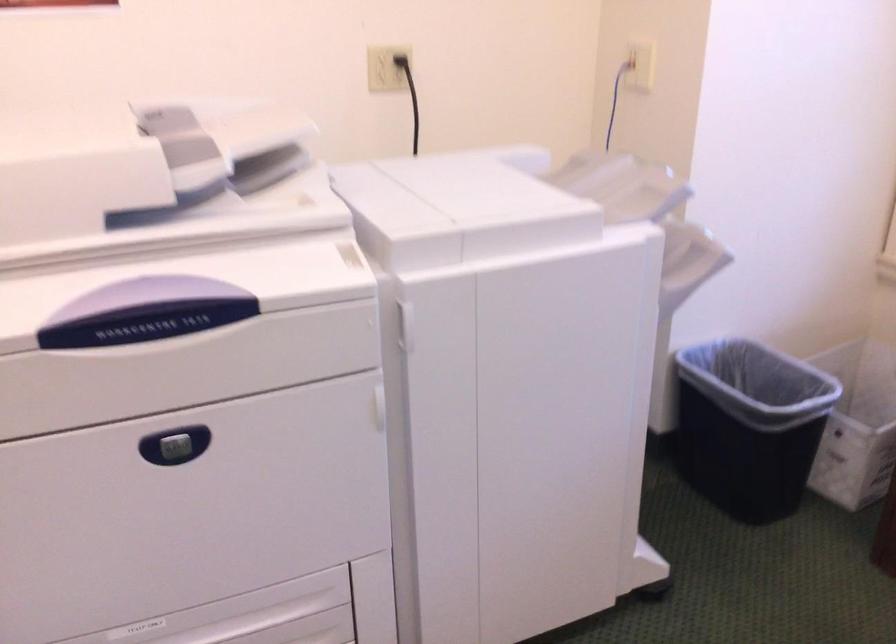
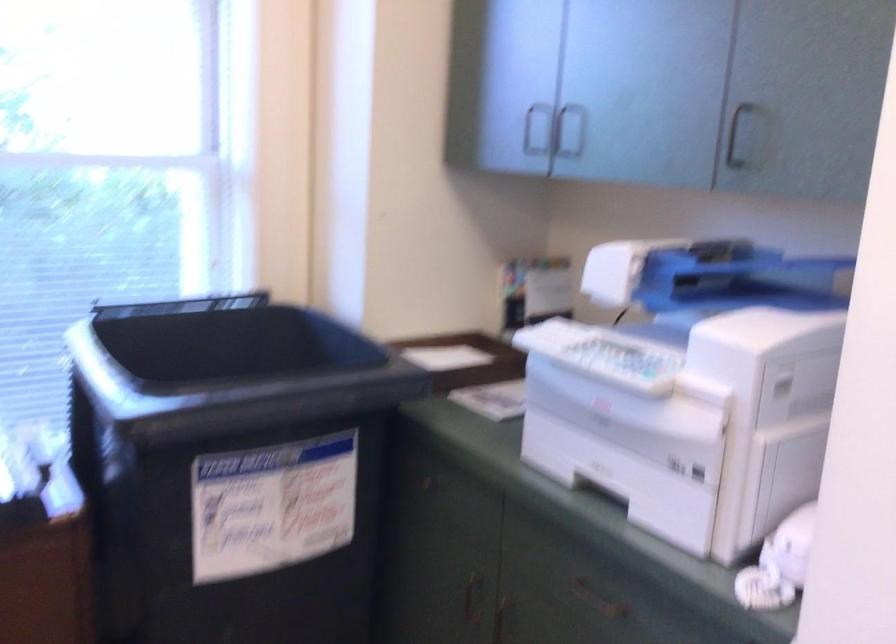
Question: The camera is either moving clockwise (left) or counter-clockwise (right) around the object. The first image is from the beginning of the video and the second image is from the end. Is the camera moving left or right when shooting the video?

Choices:
 (A) Left
 (B) Right

Answer: (A)